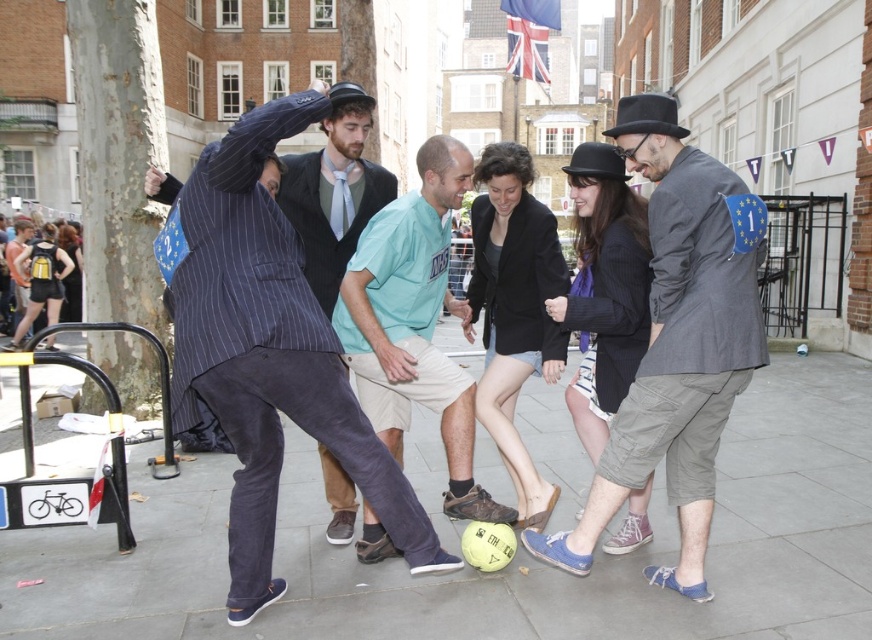
You are a photographer trying to capture a photo of the two people at the center of the scene. The gray cotton jacket at center and the light blue cotton shirt at center are both in your frame. Since you want to ensure both are fully visible, which person should you adjust your camera angle to focus on first to account for their height difference?

The gray cotton jacket at center is taller than the light blue cotton shirt at center, so you should focus on the gray cotton jacket at center first to ensure it doesn t block the shorter person.

You are a photographer standing at the edge of the plaza. You want to take a photo that includes both the gray cotton jacket at center and the light blue cotton shirt at center. The minimum distance between them is crucial for your composition. What is the closest distance you need to maintain between the two subjects to ensure they are both in frame?

The gray cotton jacket at center and light blue cotton shirt at center are 99.46 centimeters apart, so you need to maintain at least 99.46 centimeters between them to ensure both are in frame.